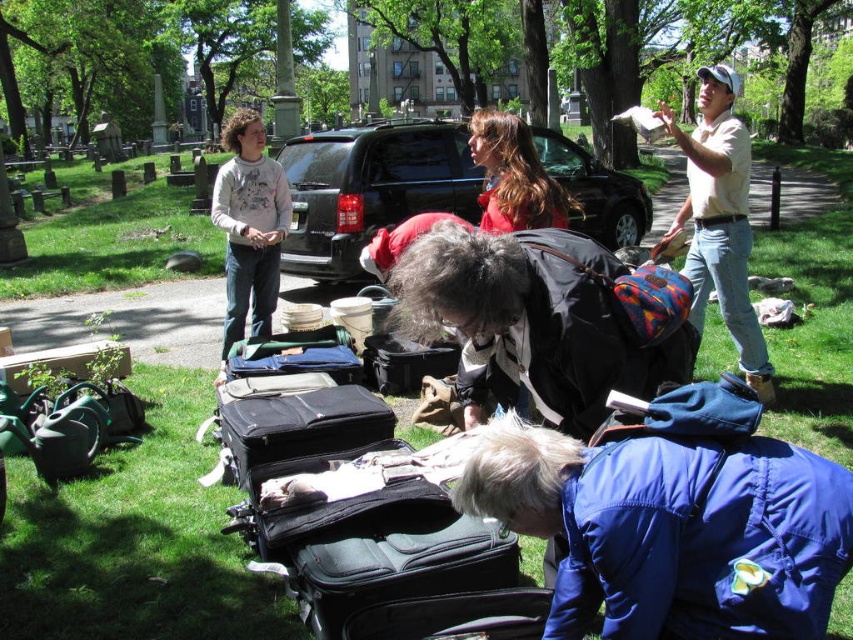
Question: Where is black leather jacket at center located in relation to light beige shirt at upper right in the image?

Choices:
 (A) below
 (B) above

Answer: (A)

Question: Estimate the real-world distances between objects in this image. Which object is farther from the black matte suv at center?

Choices:
 (A) white cotton sweatshirt at upper left
 (B) blue synthetic jacket at lower right
 (C) red wool coat at center

Answer: (B)

Question: Can you confirm if black matte suitcase at center is wider than red wool coat at center?

Choices:
 (A) yes
 (B) no

Answer: (B)

Question: Which point appears farthest from the camera in this image?

Choices:
 (A) (473, 412)
 (B) (430, 177)
 (C) (289, 218)

Answer: (B)

Question: Which point appears closest to the camera in this image?

Choices:
 (A) (483, 193)
 (B) (624, 182)
 (C) (254, 433)

Answer: (C)

Question: Is blue synthetic jacket at lower right closer to camera compared to red wool coat at center?

Choices:
 (A) yes
 (B) no

Answer: (A)